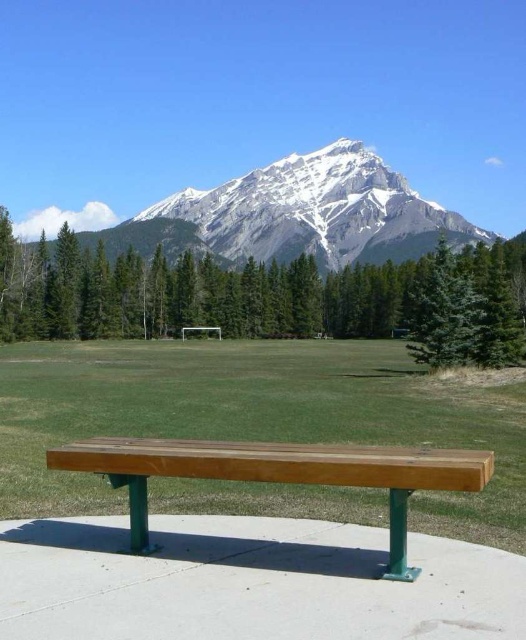
Question: Considering the real-world distances, which object is closest to the green textured tree at upper center?

Choices:
 (A) green textured pine tree at right
 (B) snowy granite mountain at upper center
 (C) wooden bench at center
 (D) green grass at center

Answer: (A)

Question: Does green textured tree at upper center appear on the right side of snowy granite mountain at upper center?

Choices:
 (A) no
 (B) yes

Answer: (B)

Question: Is snowy granite mountain at upper center smaller than green textured pine tree at right?

Choices:
 (A) no
 (B) yes

Answer: (A)

Question: Which is farther from the snowy granite mountain at upper center?

Choices:
 (A) green textured pine tree at right
 (B) green textured tree at upper center

Answer: (A)

Question: Which object is farther from the camera taking this photo?

Choices:
 (A) green textured tree at upper center
 (B) green grass at center
 (C) snowy granite mountain at upper center

Answer: (C)

Question: Is snowy granite mountain at upper center above green textured pine tree at right?

Choices:
 (A) yes
 (B) no

Answer: (A)